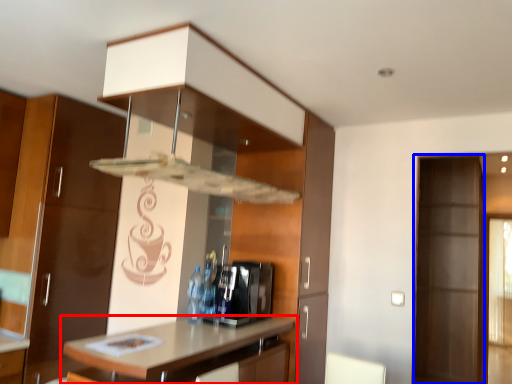
Question: Which point is further to the camera, countertop (highlighted by a red box) or screen door (highlighted by a blue box)?

Choices:
 (A) countertop
 (B) screen door

Answer: (B)